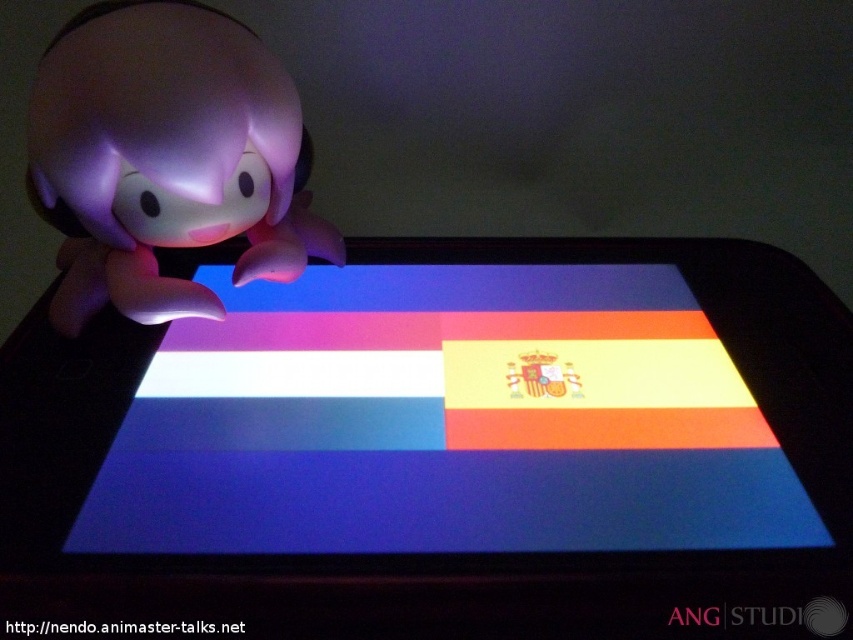
You are trying to place the pink matte toy at left on top of the matte plastic screen at center. Based on their sizes, will the toy fit entirely on the screen without overhanging the edges?

The matte plastic screen at center is wider than the pink matte toy at left, so the toy will fit entirely on the screen without overhanging the edges.

You are holding a small remote control that can move a laser pointer. The laser pointer is currently at the point marked as point (276, 429). You want to move it 1.5 meters towards the camera. Is this possible?

The distance between point (276, 429) and the camera is 1.17 meters. Moving the laser pointer 1.5 meters towards the camera would require a total distance of 1.17 meters, which is not possible since the required distance exceeds the available space. Therefore, you cannot move the laser pointer 1.5 meters towards the camera.

From the picture: You are trying to determine the arrangement of objects in the scene. Which object is placed above the other between the matte plastic screen at center and the pink matte toy at left?

The pink matte toy at left is placed above the matte plastic screen at center because the screen is positioned under it.